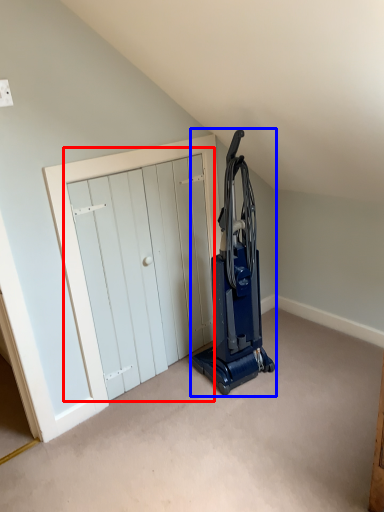
Question: Which object is further to the camera taking this photo, door (highlighted by a red box) or home appliance (highlighted by a blue box)?

Choices:
 (A) door
 (B) home appliance

Answer: (A)